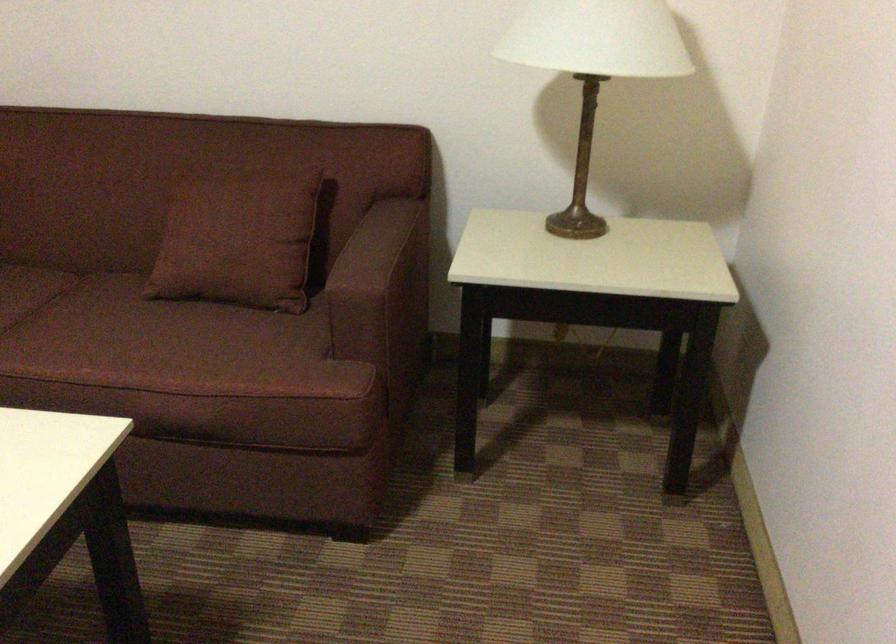
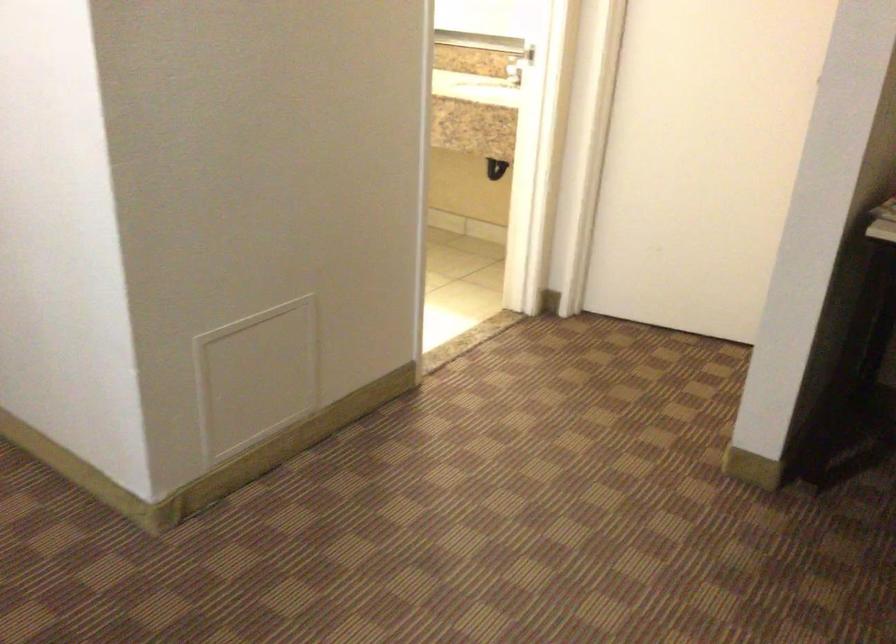
Question: How did the camera likely rotate?

Choices:
 (A) Left
 (B) Right
 (C) Up
 (D) Down

Answer: (B)